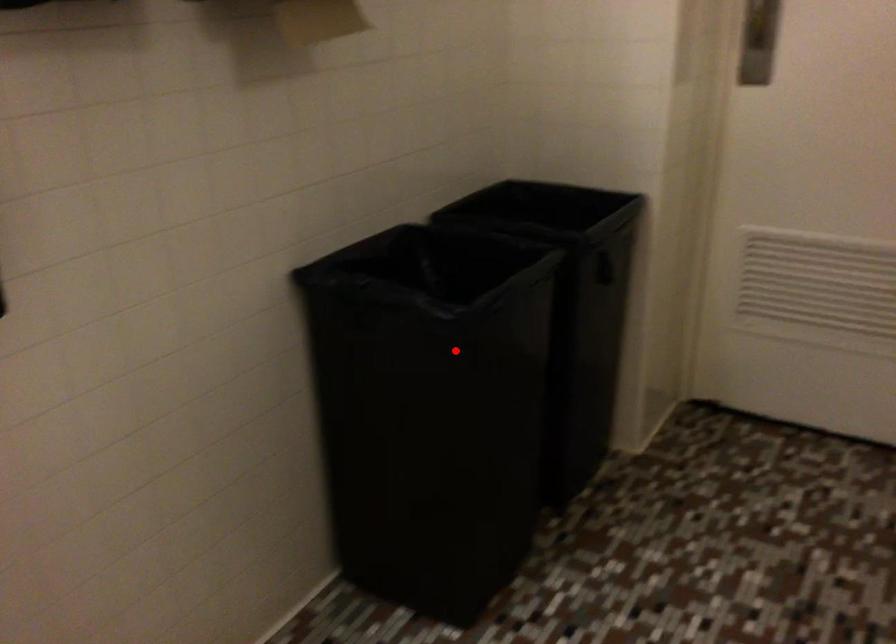
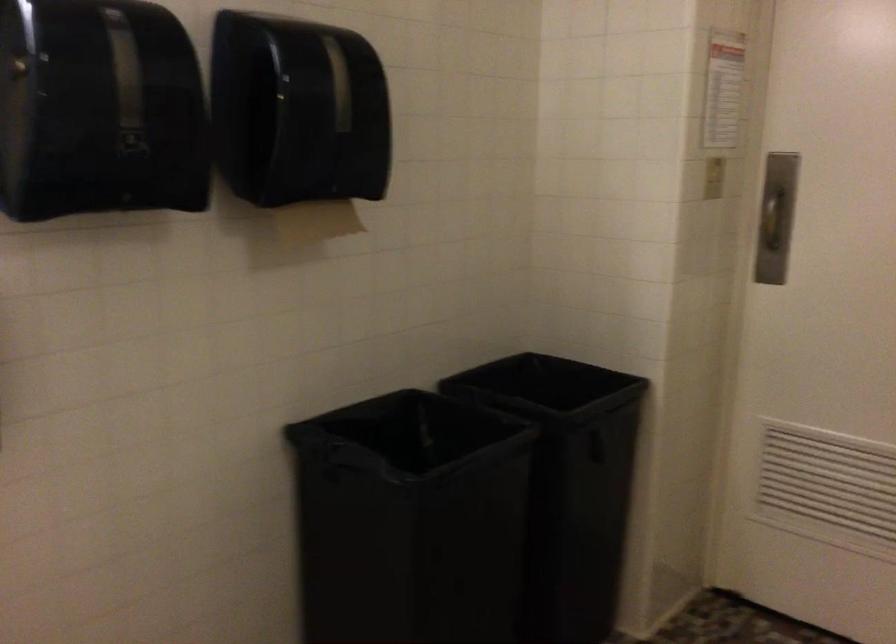
The point at the highlighted location is marked in the first image. Where is the corresponding point in the second image?

(410, 518)